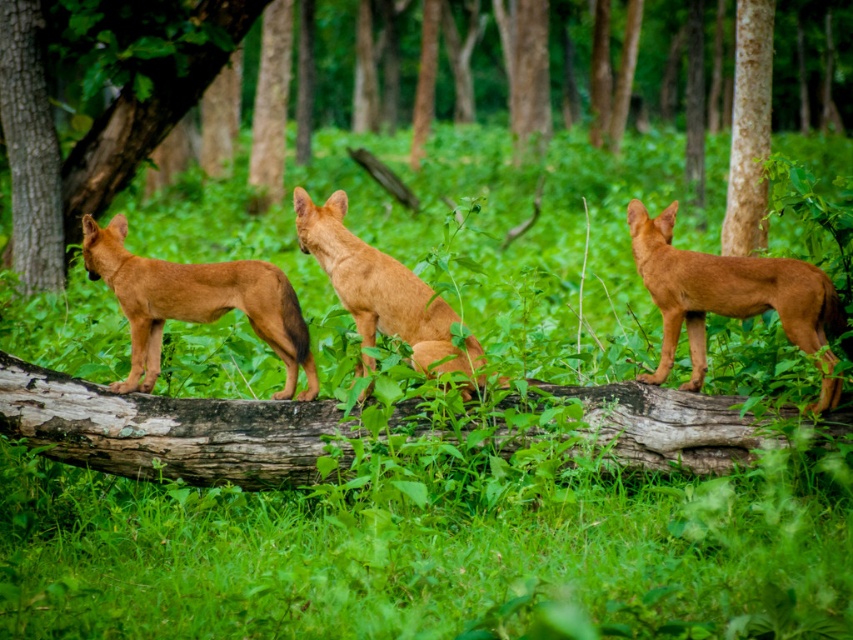
Can you confirm if brown furry dog at left is taller than brown furry dog at center?

No, brown furry dog at left is not taller than brown furry dog at center.

Can you confirm if brown furry dog at left is positioned to the left of brown furry dog at center?

Correct, you'll find brown furry dog at left to the left of brown furry dog at center.

Where is `brown furry dog at left`? The width and height of the screenshot is (853, 640). brown furry dog at left is located at coordinates (195, 304).

Which is behind, point (16, 272) or point (717, 291)?

Point (16, 272)

Does green rough bark tree at left have a lesser width compared to brown matte dog at center?

In fact, green rough bark tree at left might be wider than brown matte dog at center.

I want to click on green rough bark tree at left, so click(x=94, y=124).

Who is positioned more to the left, brown furry dog at left or brown rough bark at right?

brown furry dog at left is more to the left.

I want to click on brown furry dog at left, so click(195, 304).

This screenshot has width=853, height=640. In order to click on brown furry dog at left in this screenshot , I will do `click(195, 304)`.